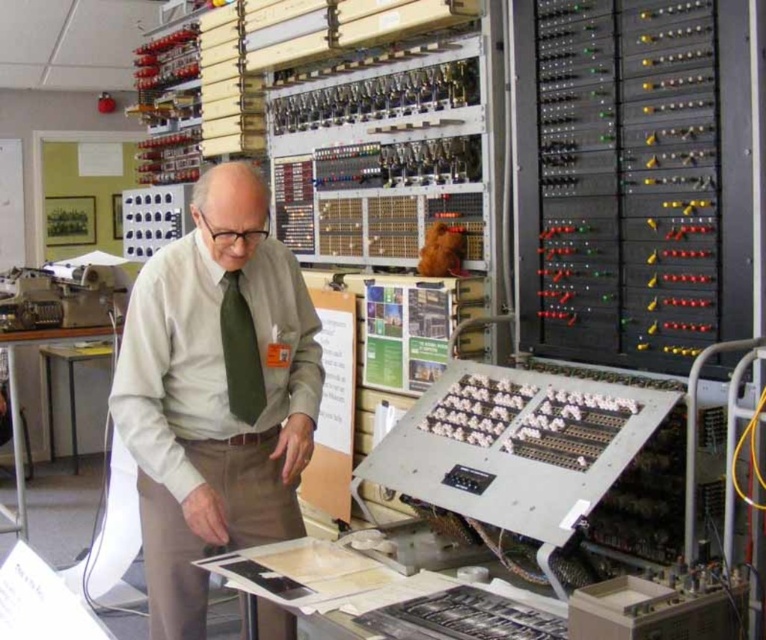
Question: Does light beige shirt at center appear over green silk tie at center?

Choices:
 (A) yes
 (B) no

Answer: (B)

Question: Which of the following is the farthest from the observer?

Choices:
 (A) (247, 352)
 (B) (146, 282)

Answer: (A)

Question: Can you confirm if light beige shirt at center is positioned to the left of green silk tie at center?

Choices:
 (A) no
 (B) yes

Answer: (B)

Question: Can you confirm if light beige shirt at center is positioned above green silk tie at center?

Choices:
 (A) yes
 (B) no

Answer: (B)

Question: Among these points, which one is nearest to the camera?

Choices:
 (A) (247, 406)
 (B) (282, 448)

Answer: (A)